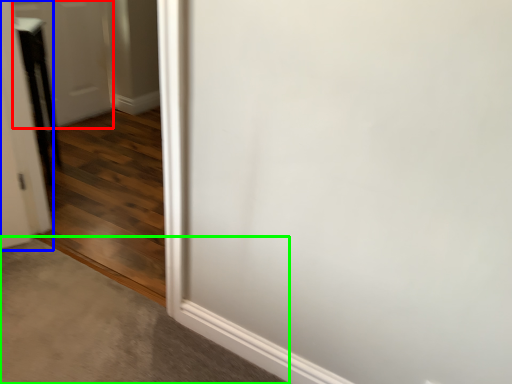
Question: Estimate the real-world distances between objects in this image. Which object is closer to door (highlighted by a red box), door (highlighted by a blue box) or concrete (highlighted by a green box)?

Choices:
 (A) door
 (B) concrete

Answer: (A)